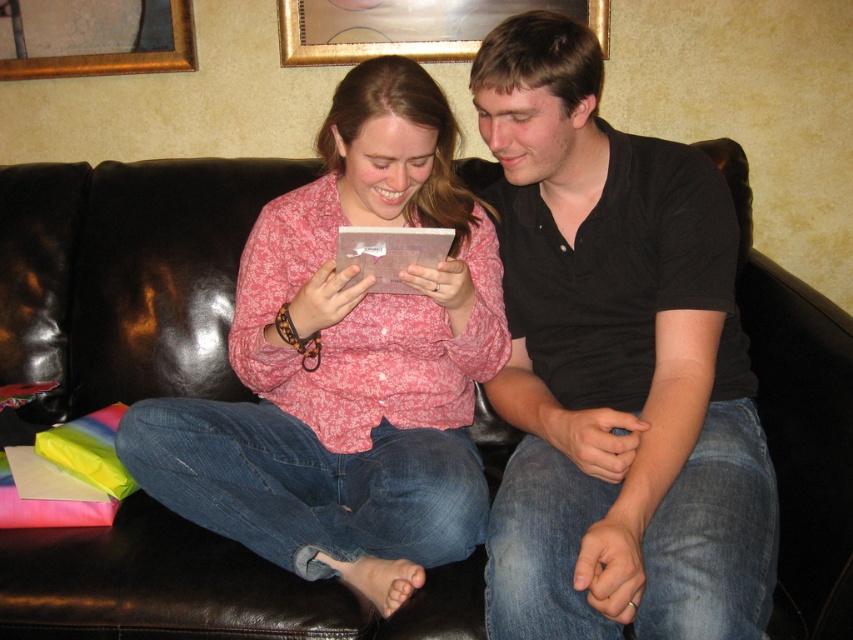
You are standing in the living room and want to place a new lamp between the two points, point [775,529] and point [323,316]. Which point should the lamp be closer to so that it is placed in front of the other point?

The lamp should be placed closer to point [775,529] because it is in front of point [323,316].

You are a tailor who needs to determine which shirt requires more fabric to alter. Based on the image, which shirt between the black cotton shirt at center and the pink floral shirt at center would need more fabric for alterations?

The black cotton shirt at center is bigger than the pink floral shirt at center, so it would require more fabric for alterations.